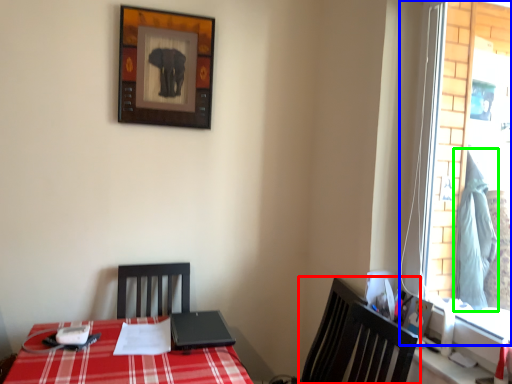
Question: Considering the real-world distances, which object is farthest from chair (highlighted by a red box)? window (highlighted by a blue box) or curtain (highlighted by a green box)?

Choices:
 (A) window
 (B) curtain

Answer: (A)